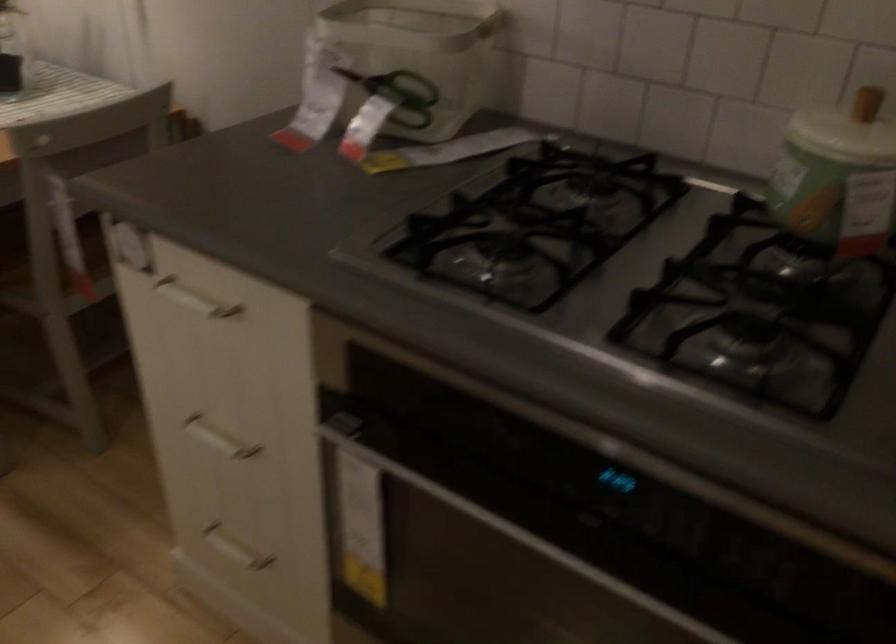
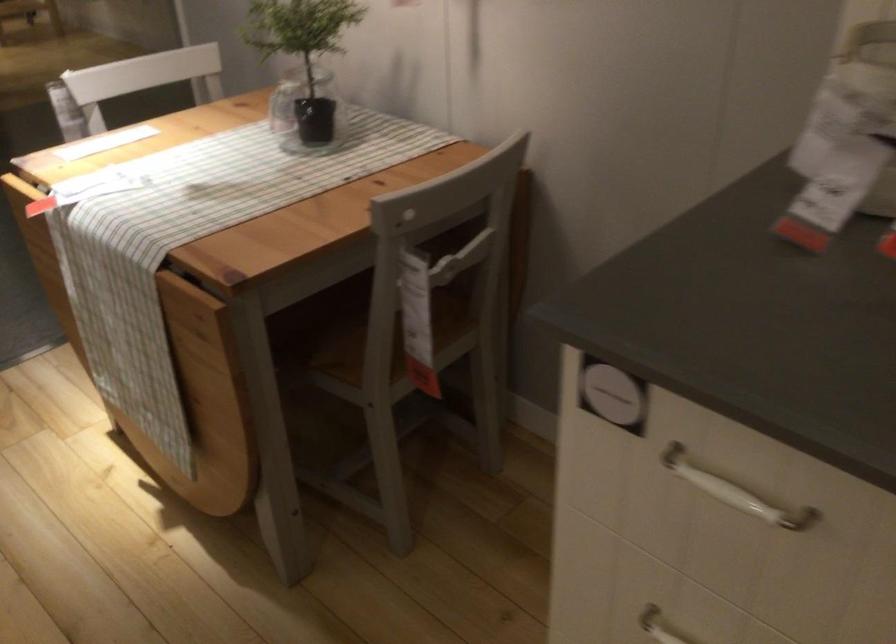
The point at (208, 431) is marked in the first image. Where is the corresponding point in the second image?

(659, 626)